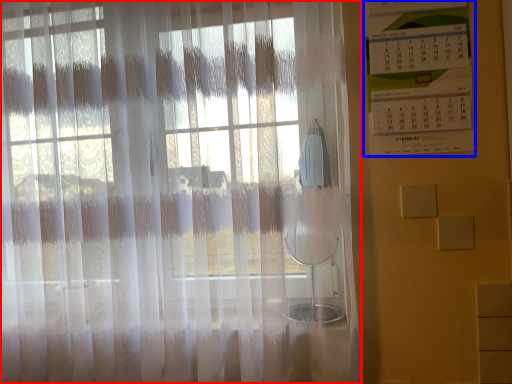
Question: Which object is closer to the camera taking this photo, curtain (highlighted by a red box) or bulletin board (highlighted by a blue box)?

Choices:
 (A) curtain
 (B) bulletin board

Answer: (A)